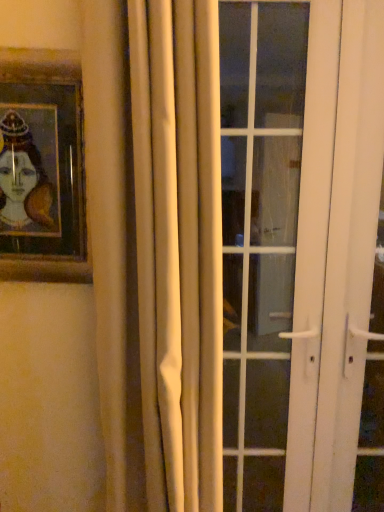
Question: From a real-world perspective, is white glass door at center positioned under white matte curtain at center based on gravity?

Choices:
 (A) no
 (B) yes

Answer: (B)

Question: Is white glass door at center looking in the opposite direction of white matte curtain at center?

Choices:
 (A) no
 (B) yes

Answer: (A)

Question: Considering the relative positions of white glass door at center and white matte curtain at center in the image provided, is white glass door at center to the left of white matte curtain at center from the viewer's perspective?

Choices:
 (A) no
 (B) yes

Answer: (A)

Question: Is white glass door at center bigger than white matte curtain at center?

Choices:
 (A) yes
 (B) no

Answer: (B)

Question: Does white glass door at center appear on the right side of white matte curtain at center?

Choices:
 (A) no
 (B) yes

Answer: (B)

Question: In terms of height, does white glass door at center look taller or shorter compared to wooden framed portrait at upper left?

Choices:
 (A) short
 (B) tall

Answer: (B)

Question: Do you think white glass door at center is within wooden framed portrait at upper left, or outside of it?

Choices:
 (A) inside
 (B) outside

Answer: (B)

Question: Is point (279, 174) positioned closer to the camera than point (41, 84)?

Choices:
 (A) closer
 (B) farther

Answer: (B)

Question: Looking at the image, does white glass door at center seem bigger or smaller compared to wooden framed portrait at upper left?

Choices:
 (A) big
 (B) small

Answer: (A)

Question: Based on their positions, is white matte curtain at center located to the left or right of white glass door at center?

Choices:
 (A) left
 (B) right

Answer: (A)

Question: Is white matte curtain at center taller or shorter than white glass door at center?

Choices:
 (A) tall
 (B) short

Answer: (B)

Question: Is white matte curtain at center wider or thinner than white glass door at center?

Choices:
 (A) thin
 (B) wide

Answer: (B)

Question: In the image, is white matte curtain at center positioned in front of or behind white glass door at center?

Choices:
 (A) behind
 (B) front

Answer: (B)

Question: Is white glass door at center taller or shorter than white matte curtain at center?

Choices:
 (A) short
 (B) tall

Answer: (B)

Question: From the image's perspective, is white glass door at center positioned above or below white matte curtain at center?

Choices:
 (A) below
 (B) above

Answer: (A)